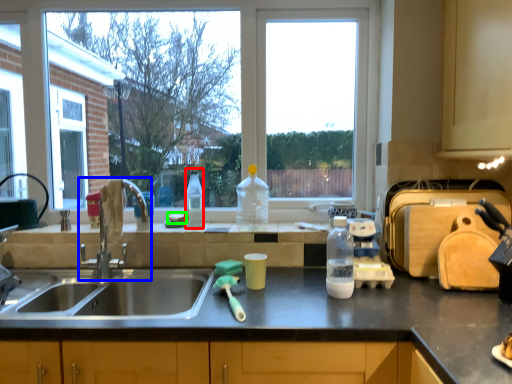
Question: Which is nearer to the bottle (highlighted by a red box)? tap (highlighted by a blue box) or food (highlighted by a green box).

Choices:
 (A) tap
 (B) food

Answer: (B)